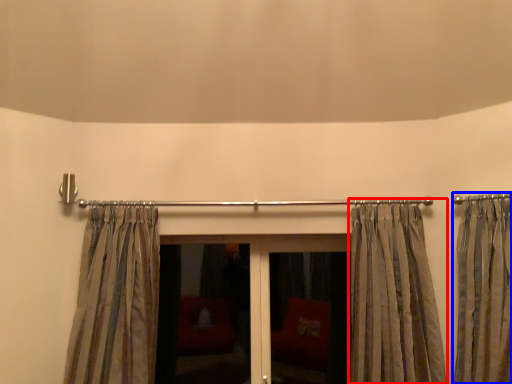
Question: Among these objects, which one is nearest to the camera, curtain (highlighted by a red box) or curtain (highlighted by a blue box)?

Choices:
 (A) curtain
 (B) curtain

Answer: (B)